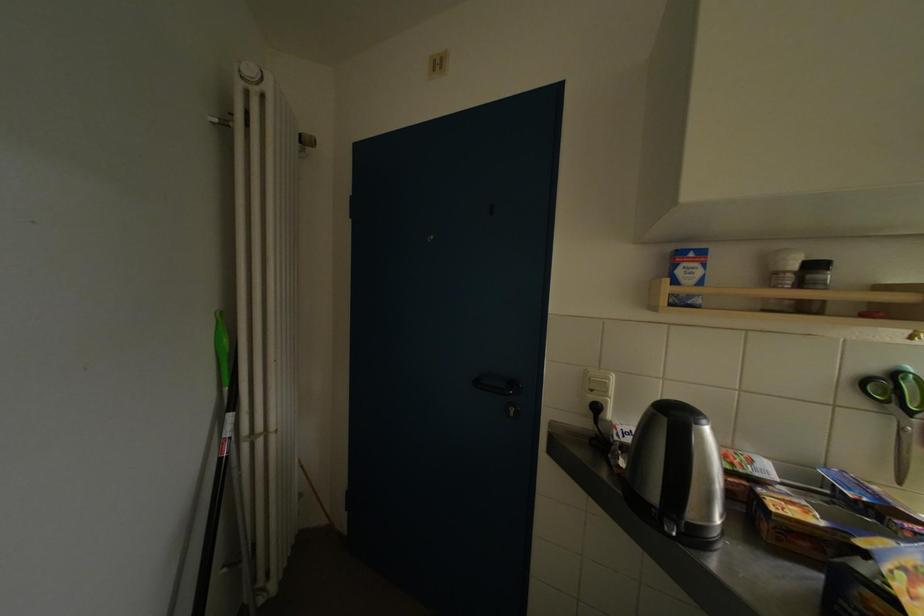
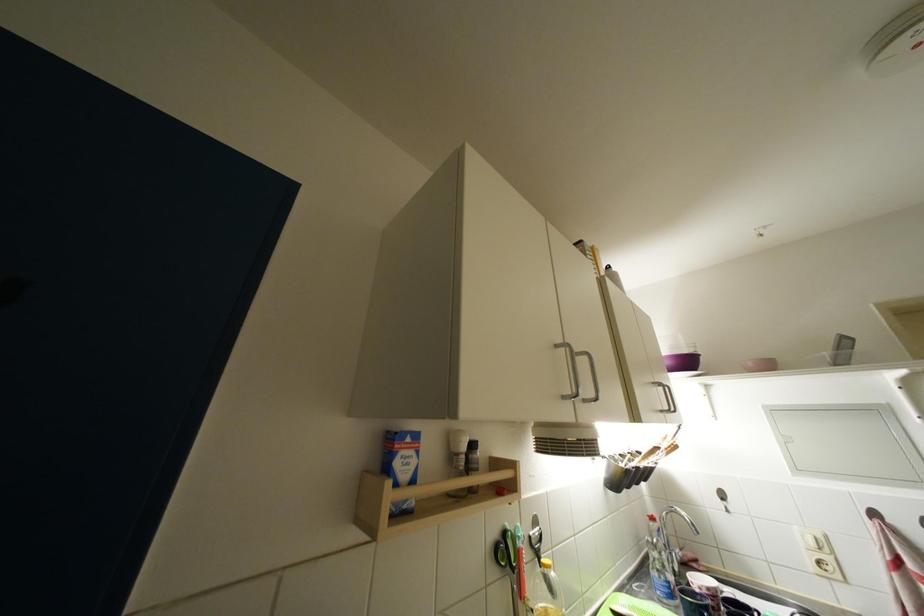
In the second image, find the point that corresponds to pixel 686 276 in the first image.

(404, 467)